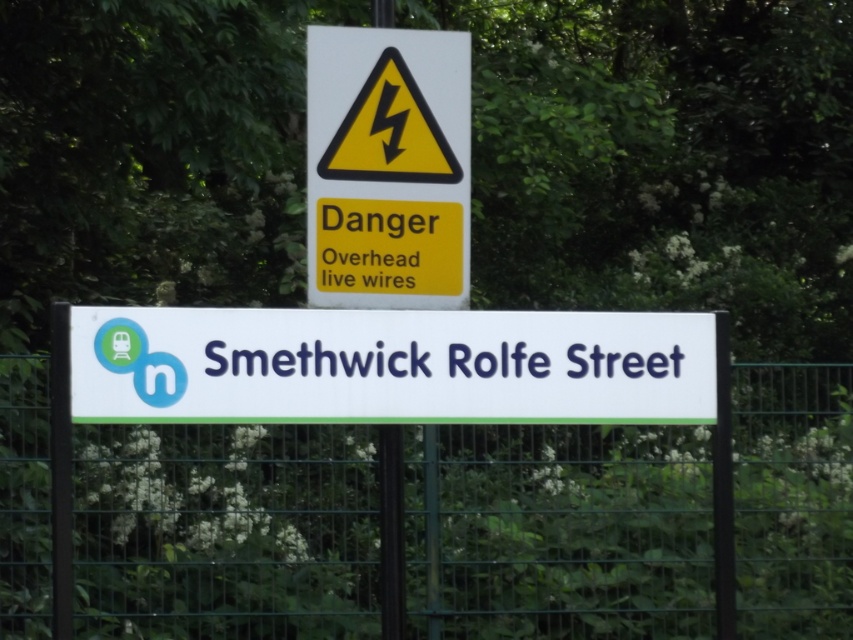
You are standing at the railway station sign for Smethwick Rolfe Street and notice two points marked on the sign. The first point is at coordinates point (785, 556) and the second is at point (132, 388). Which point is closer to you?

Point (132, 388) is closer to you because it is less further to the viewer than point (785, 556).

You are a pedestrian approaching the railway station sign. You see the green metal fence at lower center and the white plastic sign at center. Which object is closer to your right side?

The green metal fence at lower center is positioned on the right side of the white plastic sign at center, so it is closer to your right side.

You are standing at the railway station sign for Smethwick Rolfe Street. You need to locate the green metal fence at lower center. Can you tell me the coordinates where you can find it?

The green metal fence at lower center is located at point (224, 531).